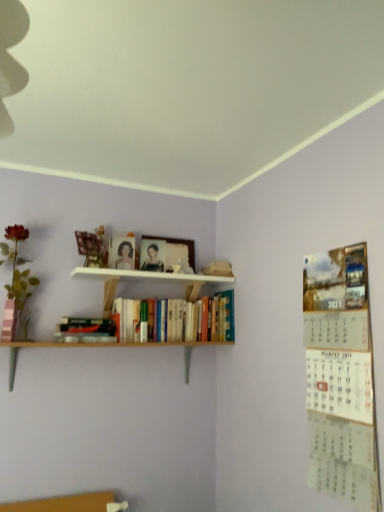
Question: Does wooden picture frame at upper center come behind matte black portrait at center?

Choices:
 (A) yes
 (B) no

Answer: (A)

Question: From the image's perspective, is wooden picture frame at upper center below matte black portrait at center?

Choices:
 (A) yes
 (B) no

Answer: (A)

Question: Considering the relative sizes of wooden picture frame at upper center and matte black portrait at center in the image provided, is wooden picture frame at upper center shorter than matte black portrait at center?

Choices:
 (A) yes
 (B) no

Answer: (B)

Question: Is wooden picture frame at upper center at the left side of matte black portrait at center?

Choices:
 (A) yes
 (B) no

Answer: (B)

Question: Are wooden picture frame at upper center and matte black portrait at center far apart?

Choices:
 (A) no
 (B) yes

Answer: (A)

Question: From a real-world perspective, is hardcover books at center, which is the first book in right-to-left order, positioned above or below hardcover book at lower left, the second book viewed from the right?

Choices:
 (A) above
 (B) below

Answer: (A)

Question: In the image, is hardcover books at center, which is the first book in right-to-left order, positioned in front of or behind hardcover book at lower left, the second book viewed from the right?

Choices:
 (A) front
 (B) behind

Answer: (B)

Question: Considering the positions of hardcover books at center, which is the first book in right-to-left order, and hardcover book at lower left, the second book viewed from the right, in the image, is hardcover books at center, which is the first book in right-to-left order, wider or thinner than hardcover book at lower left, the second book viewed from the right,?

Choices:
 (A) wide
 (B) thin

Answer: (A)

Question: From their relative heights in the image, would you say hardcover books at center, which is the first book in right-to-left order, is taller or shorter than hardcover book at lower left, the first book in the left-to-right sequence?

Choices:
 (A) short
 (B) tall

Answer: (B)

Question: In the image, is hardcover books at center, arranged as the 2th book when viewed from the left, positioned in front of or behind wooden picture frame at upper center?

Choices:
 (A) behind
 (B) front

Answer: (B)

Question: In terms of size, does hardcover books at center, which is the first book in right-to-left order, appear bigger or smaller than wooden picture frame at upper center?

Choices:
 (A) big
 (B) small

Answer: (A)

Question: Visually, is hardcover books at center, arranged as the 2th book when viewed from the left, positioned to the left or to the right of wooden picture frame at upper center?

Choices:
 (A) left
 (B) right

Answer: (B)

Question: Is point (152, 316) positioned closer to the camera than point (188, 251)?

Choices:
 (A) closer
 (B) farther

Answer: (A)

Question: Based on their sizes in the image, would you say metallic paper calendar at right is bigger or smaller than hardcover book at lower left, the second book viewed from the right?

Choices:
 (A) small
 (B) big

Answer: (B)

Question: Does point (314, 370) appear closer or farther from the camera than point (102, 328)?

Choices:
 (A) closer
 (B) farther

Answer: (A)